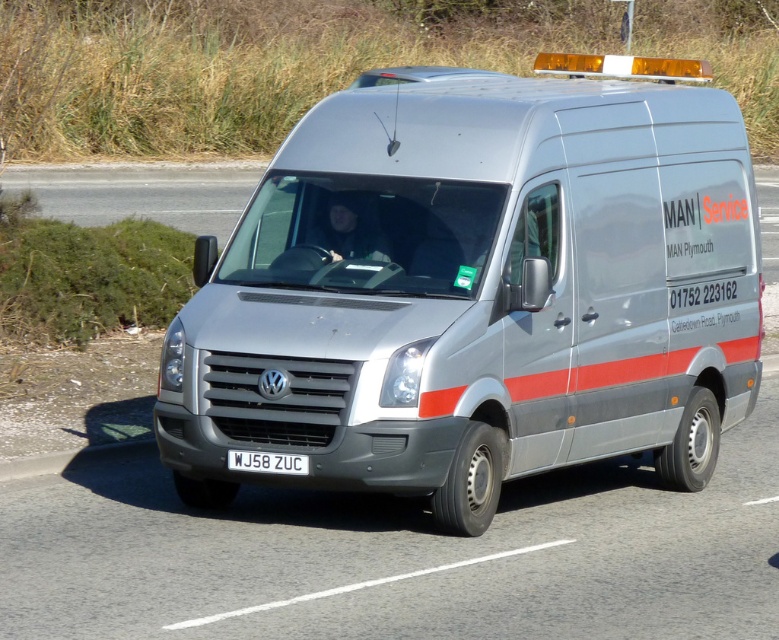
Does satin silver van at center appear over white plastic license plate at center?

Indeed, satin silver van at center is positioned over white plastic license plate at center.

Who is taller, satin silver van at center or white plastic license plate at center?

With more height is satin silver van at center.

Is point (624, 353) positioned before point (291, 470)?

No, it is behind (291, 470).

You are a GUI agent. You are given a task and a screenshot of the screen. Output one action in this format:
    pyautogui.click(x=<x>, y=<y>)
    Task: Click on the satin silver van at center
    
    Given the screenshot: What is the action you would take?
    pyautogui.click(x=478, y=291)